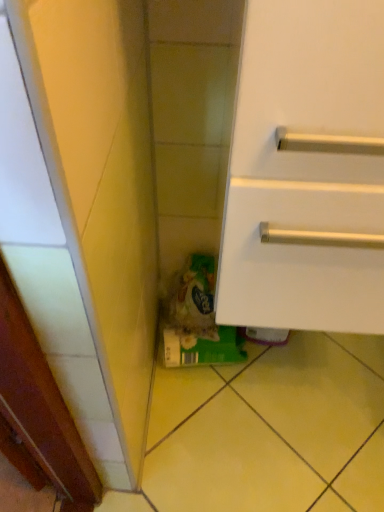
Question: From a real-world perspective, is green plastic bag at lower center beneath white matte cabinet at lower right?

Choices:
 (A) no
 (B) yes

Answer: (B)

Question: Considering the relative positions of green plastic bag at lower center and white matte cabinet at lower right in the image provided, is green plastic bag at lower center behind white matte cabinet at lower right?

Choices:
 (A) no
 (B) yes

Answer: (B)

Question: Is green plastic bag at lower center aimed at white matte cabinet at lower right?

Choices:
 (A) no
 (B) yes

Answer: (A)

Question: Can you confirm if green plastic bag at lower center is wider than white matte cabinet at lower right?

Choices:
 (A) no
 (B) yes

Answer: (A)

Question: Is green plastic bag at lower center shorter than white matte cabinet at lower right?

Choices:
 (A) no
 (B) yes

Answer: (B)

Question: From the image's perspective, does green plastic bag at lower center appear lower than white matte cabinet at lower right?

Choices:
 (A) yes
 (B) no

Answer: (A)

Question: From a real-world perspective, is white matte cabinet at lower right beneath green plastic bag at lower center?

Choices:
 (A) yes
 (B) no

Answer: (B)

Question: Can you confirm if white matte cabinet at lower right is thinner than green plastic bag at lower center?

Choices:
 (A) yes
 (B) no

Answer: (B)

Question: Is white matte cabinet at lower right shorter than green plastic bag at lower center?

Choices:
 (A) yes
 (B) no

Answer: (B)

Question: From the image's perspective, is white matte cabinet at lower right under green plastic bag at lower center?

Choices:
 (A) yes
 (B) no

Answer: (B)

Question: Considering the relative positions of white matte cabinet at lower right and green plastic bag at lower center in the image provided, is white matte cabinet at lower right behind green plastic bag at lower center?

Choices:
 (A) yes
 (B) no

Answer: (B)

Question: Considering the relative positions of white matte cabinet at lower right and green plastic bag at lower center in the image provided, is white matte cabinet at lower right to the left of green plastic bag at lower center from the viewer's perspective?

Choices:
 (A) no
 (B) yes

Answer: (A)

Question: Considering the positions of white matte cabinet at lower right and green plastic bag at lower center in the image, is white matte cabinet at lower right taller or shorter than green plastic bag at lower center?

Choices:
 (A) short
 (B) tall

Answer: (B)